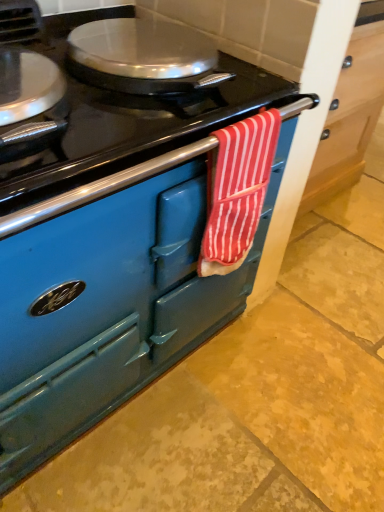
Question: Should I look upward or downward to see red striped towel at center?

Choices:
 (A) down
 (B) up

Answer: (B)

Question: From a real-world perspective, is matte blue oven at center positioned over red striped towel at center based on gravity?

Choices:
 (A) yes
 (B) no

Answer: (B)

Question: Is matte blue oven at center aimed at red striped towel at center?

Choices:
 (A) no
 (B) yes

Answer: (A)

Question: Is matte blue oven at center looking in the opposite direction of red striped towel at center?

Choices:
 (A) yes
 (B) no

Answer: (B)

Question: Does matte blue oven at center appear on the right side of red striped towel at center?

Choices:
 (A) no
 (B) yes

Answer: (B)

Question: Is red striped towel at center completely or partially inside matte blue oven at center?

Choices:
 (A) yes
 (B) no

Answer: (B)

Question: Is the surface of matte blue oven at center in direct contact with red striped towel at center?

Choices:
 (A) yes
 (B) no

Answer: (B)

Question: Considering the relative sizes of red striped towel at center and matte blue oven at center in the image provided, is red striped towel at center smaller than matte blue oven at center?

Choices:
 (A) no
 (B) yes

Answer: (B)

Question: Can you see red striped towel at center touching matte blue oven at center?

Choices:
 (A) no
 (B) yes

Answer: (A)

Question: Would you say red striped towel at center is outside matte blue oven at center?

Choices:
 (A) no
 (B) yes

Answer: (B)

Question: From a real-world perspective, is red striped towel at center positioned over matte blue oven at center based on gravity?

Choices:
 (A) no
 (B) yes

Answer: (B)

Question: Is red striped towel at center aimed at matte blue oven at center?

Choices:
 (A) no
 (B) yes

Answer: (A)

Question: Does red striped towel at center come behind matte blue oven at center?

Choices:
 (A) no
 (B) yes

Answer: (B)

Question: Is red striped towel at center inside the boundaries of matte blue oven at center, or outside?

Choices:
 (A) inside
 (B) outside

Answer: (B)